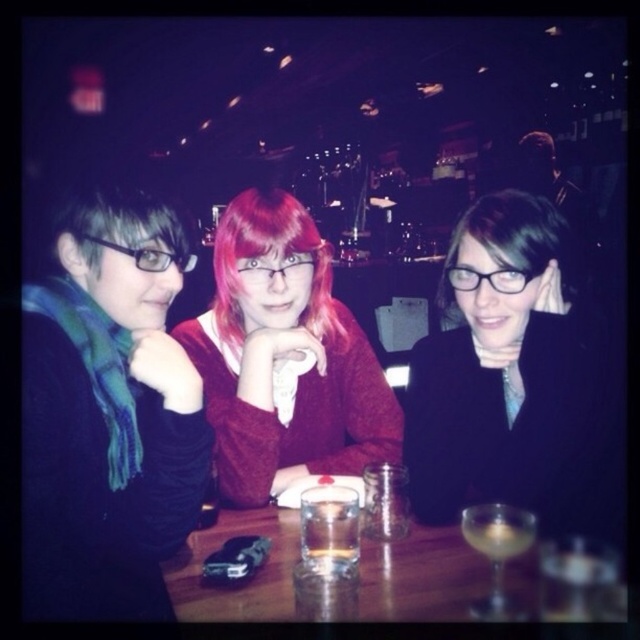
Is point (28, 563) positioned in front of point (525, 572)?

Yes, point (28, 563) is closer to viewer.

Which is more to the left, green knitted scarf at left or transparent glass table at center?

→ Positioned to the left is green knitted scarf at left.

Who is more forward, (140, 273) or (525, 561)?

Positioned in front is point (140, 273).

You are a GUI agent. You are given a task and a screenshot of the screen. Output one action in this format:
    pyautogui.click(x=<x>, y=<y>)
    Task: Click on the green knitted scarf at left
    
    Given the screenshot: What is the action you would take?
    pyautogui.click(x=108, y=412)

Between point (216, 538) and point (353, 512), which one is positioned in front?

Point (353, 512)

Does transparent glass table at center have a greater width compared to translucent glass at center?

Indeed, transparent glass table at center has a greater width compared to translucent glass at center.

Who is more forward, (189, 611) or (333, 561)?

Point (189, 611) is in front.

Where is `transparent glass table at center`? This screenshot has height=640, width=640. transparent glass table at center is located at coordinates (413, 579).

Based on the photo, does pink silky hair at center appear on the left side of translucent glass at table center?

Indeed, pink silky hair at center is positioned on the left side of translucent glass at table center.

Can you confirm if pink silky hair at center is taller than translucent glass at table center?

Correct, pink silky hair at center is much taller as translucent glass at table center.

The width and height of the screenshot is (640, 640). I want to click on pink silky hair at center, so click(275, 253).